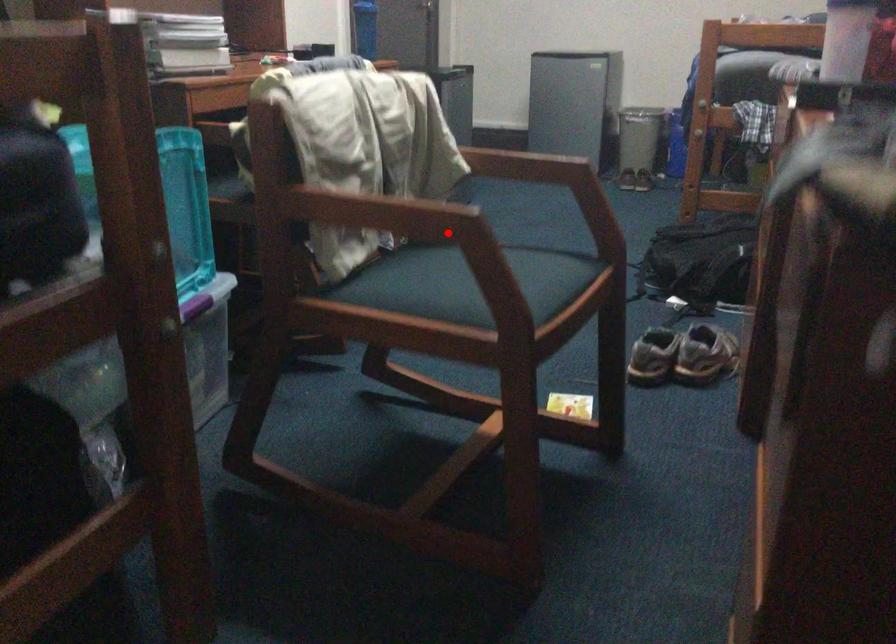
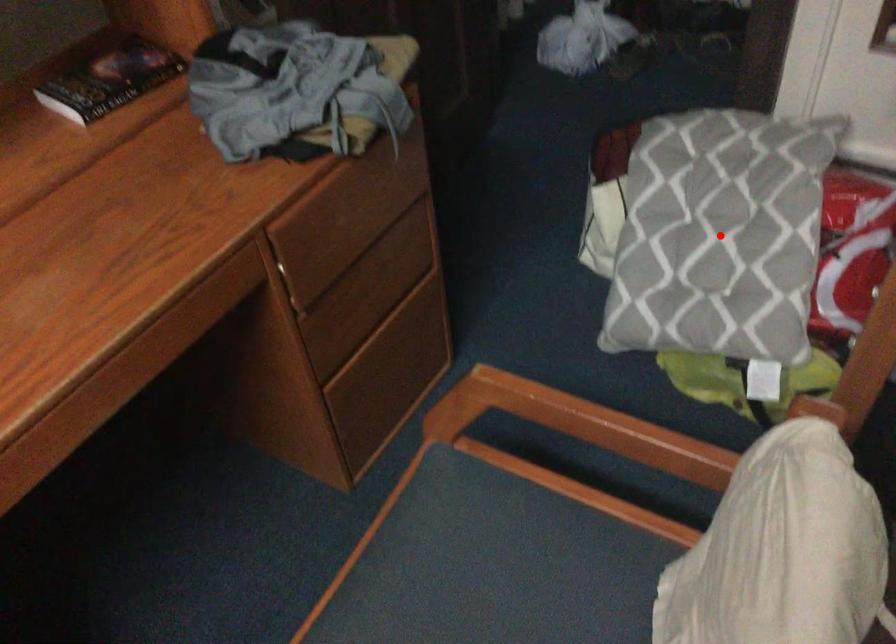
I am providing you with two images of the same scene from different viewpoints. A red point is marked on the first image and another point is marked on the second image. Does the point marked in image1 correspond to the same location as the one in image2?

No